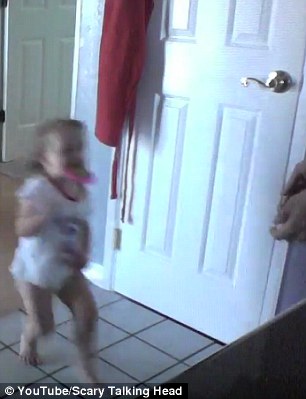
In order to click on door panels in this screenshot , I will do `click(166, 161)`, `click(219, 227)`, `click(31, 82)`, `click(65, 52)`, `click(179, 16)`, `click(252, 21)`.